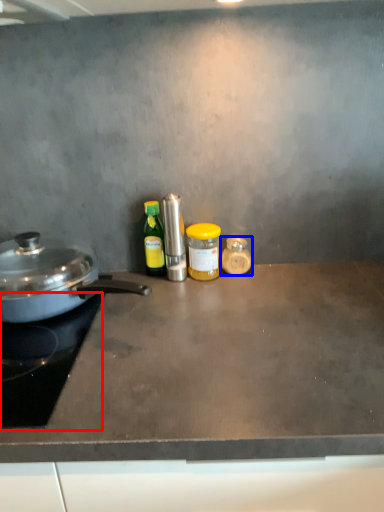
Question: Which object is closer to the camera taking this photo, gas stove (highlighted by a red box) or kitchen appliance (highlighted by a blue box)?

Choices:
 (A) gas stove
 (B) kitchen appliance

Answer: (A)